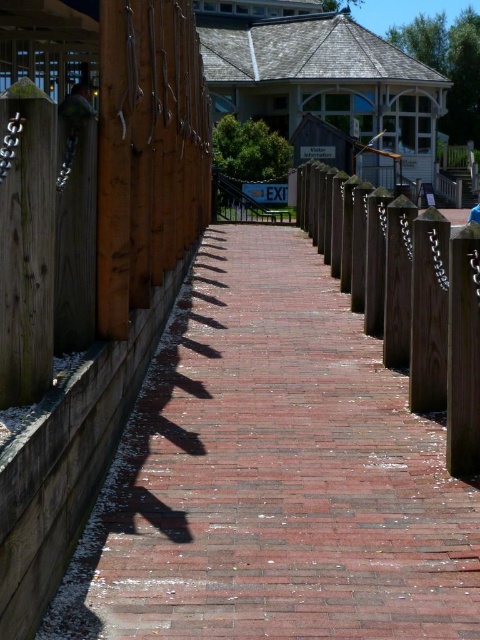
You are a delivery person with a cart that is 5 feet wide. You need to navigate through the pathway. Can your cart fit between the red brick path at center and the wooden post at center?

The distance between the red brick path at center and the wooden post at center is 7.04 feet, which is wider than your cart that is 5 feet wide. Therefore, your cart can fit between them.

Looking at this image, you are a gardener planning to place a 1.5 meter wide decorative stone slab on the pathway. Given the red brick path at center and the wooden post at center, which object can accommodate the slab in terms of width?

The red brick path at center can accommodate the 1.5 meter wide decorative stone slab since its width surpasses that of the wooden post at center.

You are standing at the center of the image and want to walk towards the red brick path at center. Which direction should you move to reach it?

Since the red brick path at center is located at coordinates 0.744 on the x axis and 0.569 on the y axis, you should move towards the right and slightly downward from the center to reach it.